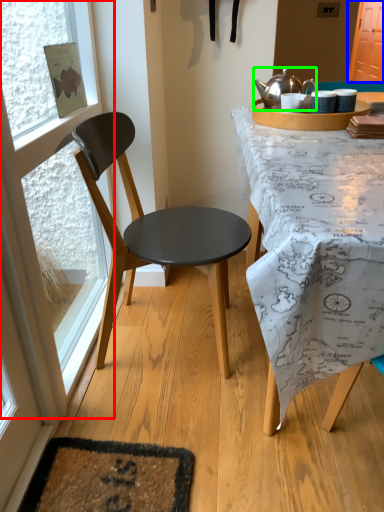
Question: Estimate the real-world distances between objects in this image. Which object is closer to glass door (highlighted by a red box), screen door (highlighted by a blue box) or kettle (highlighted by a green box)?

Choices:
 (A) screen door
 (B) kettle

Answer: (B)